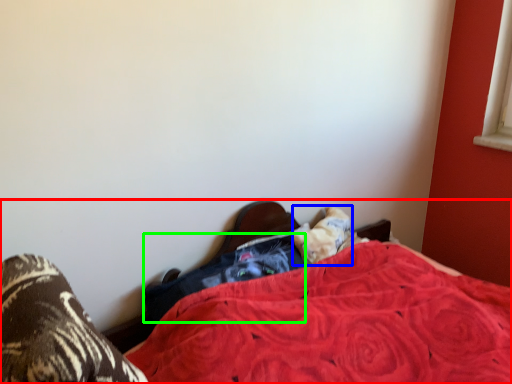
Question: Which is nearer to the bed (highlighted by a red box)? pillow (highlighted by a blue box) or clothing (highlighted by a green box).

Choices:
 (A) pillow
 (B) clothing

Answer: (B)